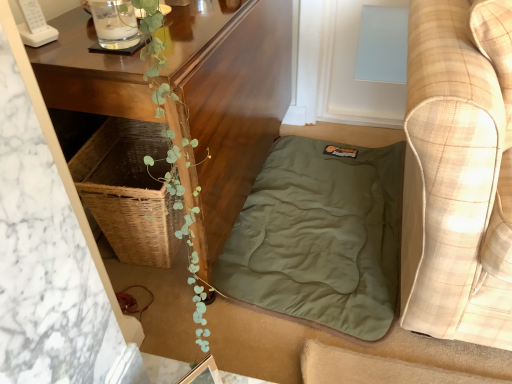
Question: In terms of width, does plaid fabric couch at right look wider or thinner when compared to wooden table at center?

Choices:
 (A) wide
 (B) thin

Answer: (A)

Question: From a real-world perspective, is plaid fabric couch at right above or below wooden table at center?

Choices:
 (A) below
 (B) above

Answer: (B)

Question: Which object is positioned farthest from the wooden table at center?

Choices:
 (A) plaid fabric couch at right
 (B) olive green fabric at lower center

Answer: (A)

Question: Considering the real-world distances, which object is closest to the olive green fabric at lower center?

Choices:
 (A) plaid fabric couch at right
 (B) wooden table at center

Answer: (B)